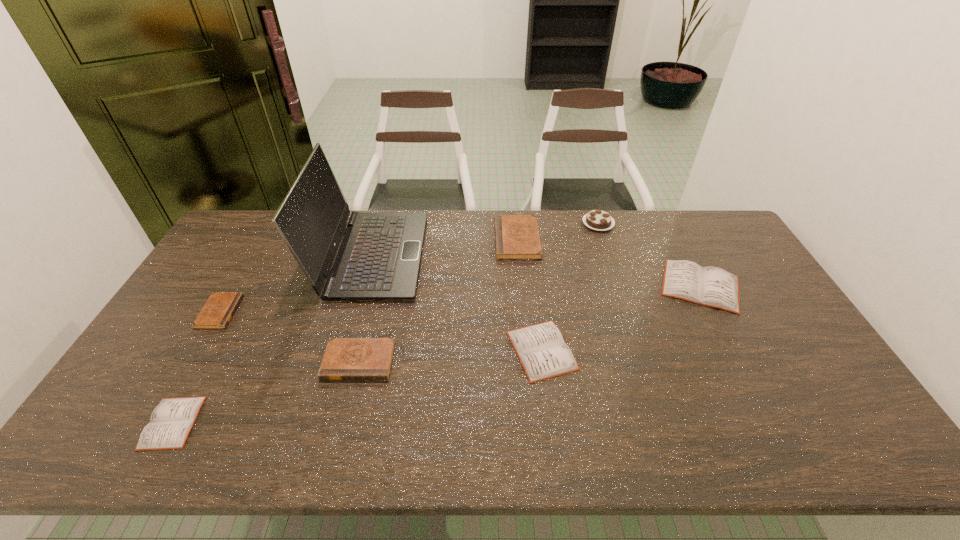
Image resolution: width=960 pixels, height=540 pixels. I want to click on vacant region between the tallest diary and the chocolate cake, so click(558, 231).

Locate an element on the screen. This screenshot has height=540, width=960. vacant space that is in between the nearest white diary and the smallest brown diary is located at coordinates (196, 367).

You are a GUI agent. You are given a task and a screenshot of the screen. Output one action in this format:
    pyautogui.click(x=<x>, y=<y>)
    Task: Click on the unoccupied position between the nearest object and the second brown diary from left to right
    The height and width of the screenshot is (540, 960).
    Given the screenshot: What is the action you would take?
    pyautogui.click(x=266, y=392)

Find the location of a particular element. This screenshot has width=960, height=540. free space between the second smallest white diary and the chocolate cake is located at coordinates (570, 287).

The width and height of the screenshot is (960, 540). In order to click on vacant space in between the second smallest brown diary and the seventh shortest object in this screenshot , I will do `click(478, 292)`.

Find the location of a particular element. empty location between the black laptop computer and the chocolate cake is located at coordinates (485, 239).

The height and width of the screenshot is (540, 960). I want to click on object identified as the fourth closest to the chocolate cake, so pyautogui.click(x=378, y=259).

I want to click on the fifth closest object to the black laptop computer, so click(171, 421).

Locate which diary ranks sixth in proximity to the black laptop computer. Please provide its 2D coordinates. Your answer should be formatted as a tuple, i.e. [(x, y)], where the tuple contains the x and y coordinates of a point satisfying the conditions above.

[(711, 286)]

Image resolution: width=960 pixels, height=540 pixels. What are the coordinates of `diary that is the fourth closest to the farthest brown diary` in the screenshot? It's located at (219, 309).